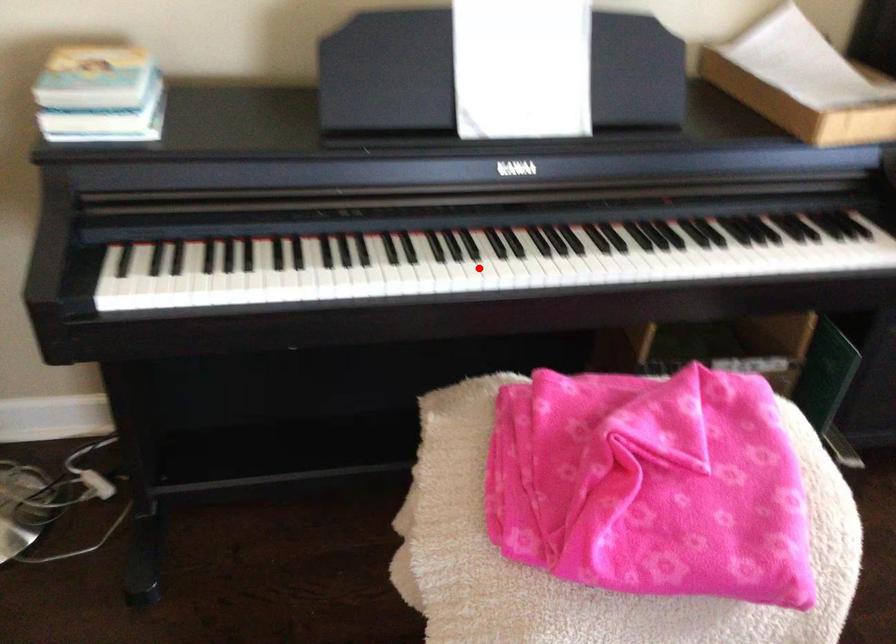
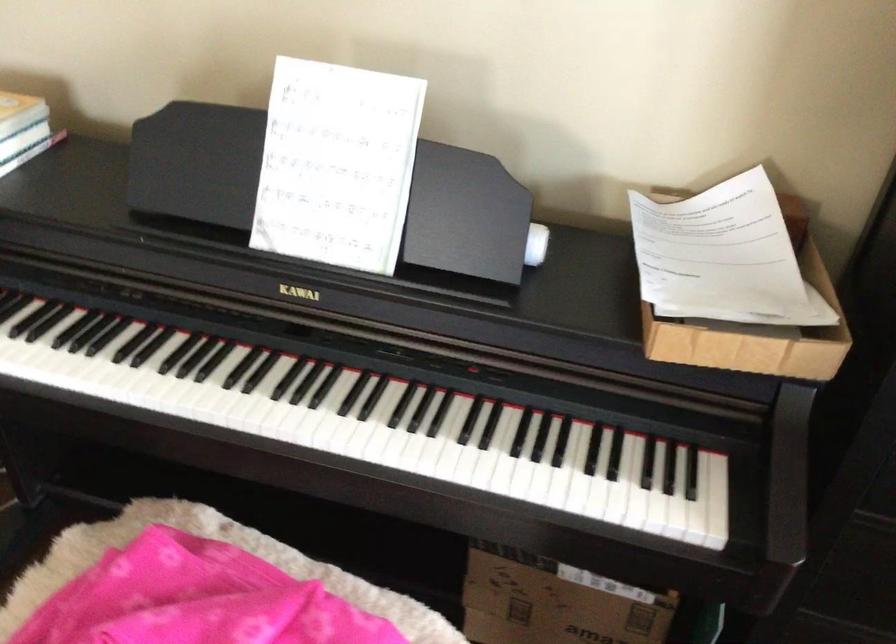
Where in the second image is the point corresponding to the highlighted location from the first image?

(177, 397)